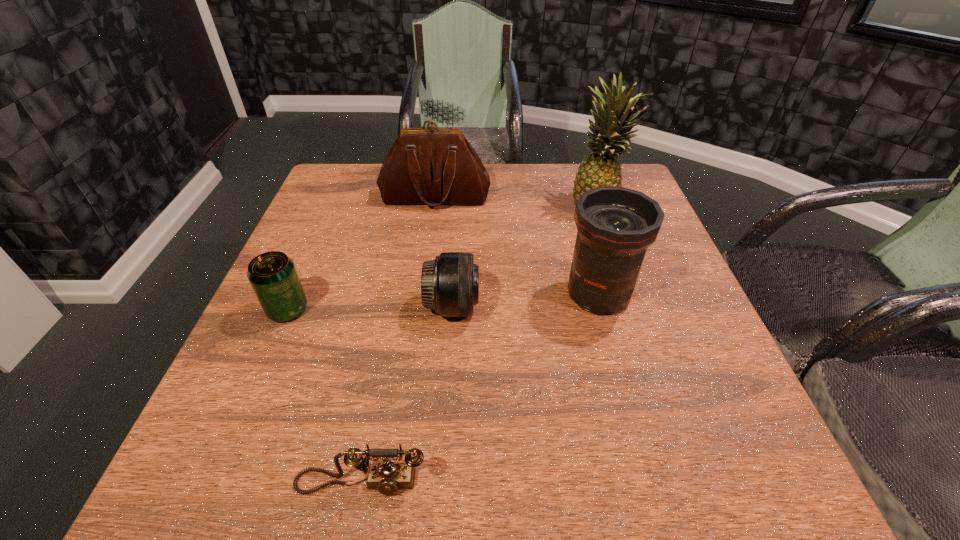
You are a GUI agent. You are given a task and a screenshot of the screen. Output one action in this format:
    pyautogui.click(x=<x>, y=<y>)
    Task: Click on the object that stands as the closest to the left telephoto lens
    
    Given the screenshot: What is the action you would take?
    pyautogui.click(x=616, y=225)